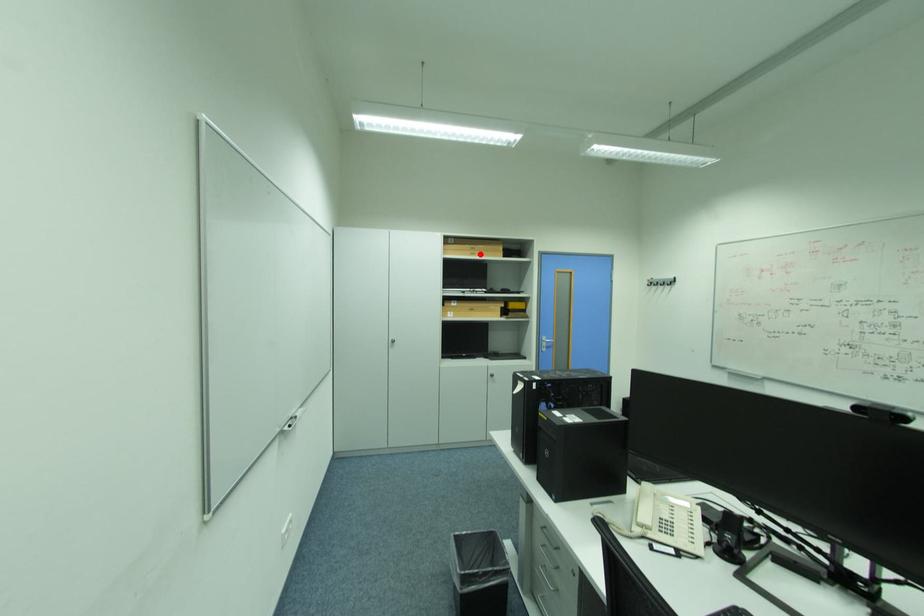
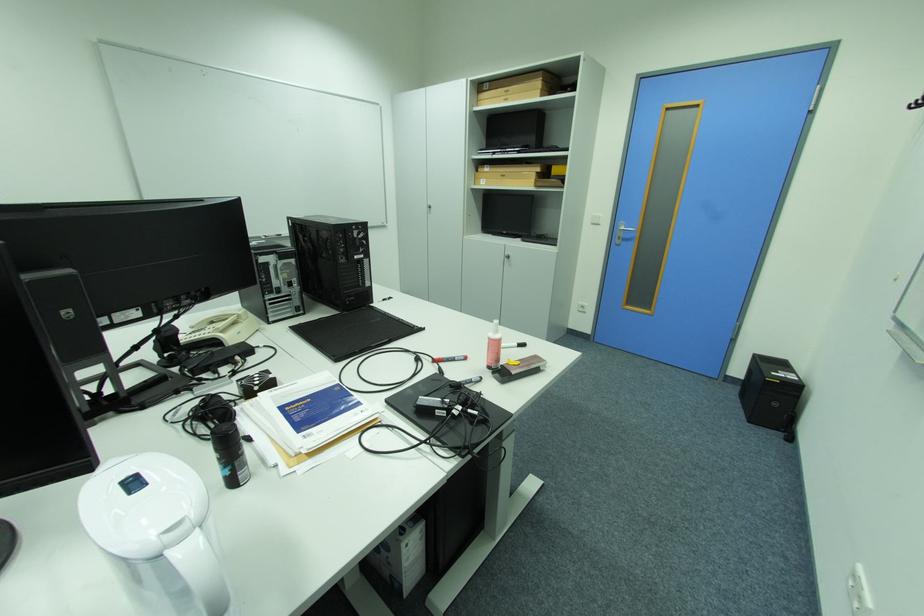
Question: A red point is marked in image1. In image2, is the corresponding 3D point closer to the camera or farther? Reply with the corresponding letter.

Choices:
 (A) The corresponding 3D point is closer.
 (B) The corresponding 3D point is farther.

Answer: (A)